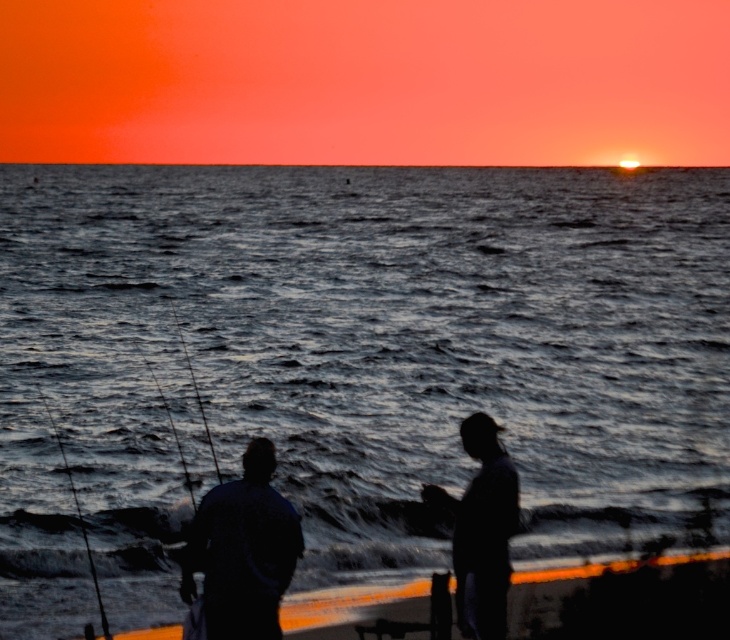
How distant is dark gray water at center from metallic fishing pole at left?

dark gray water at center and metallic fishing pole at left are 220.48 feet apart from each other.

Does dark gray water at center have a lesser height compared to metallic fishing pole at left?

No, dark gray water at center is not shorter than metallic fishing pole at left.

Is point (153, 474) closer to camera compared to point (182, 452)?

Yes, it is.

At what (x,y) coordinates should I click in order to perform the action: click on dark gray water at center. Please return your answer as a coordinate pair (x, y). Image resolution: width=730 pixels, height=640 pixels. Looking at the image, I should click on (353, 364).

Between silhouette fishing rod at lower right and smooth black fishing pole at center-left, which one is positioned higher?

Positioned higher is smooth black fishing pole at center-left.

Is silhouette fishing rod at lower right thinner than smooth black fishing pole at center-left?

Yes.

Which is behind, point (491, 634) or point (180, 337)?

Positioned behind is point (180, 337).

Where is `silhouette fishing rod at lower right`? Image resolution: width=730 pixels, height=640 pixels. silhouette fishing rod at lower right is located at coordinates (480, 529).

Does silhouette fishing rod at center come in front of smooth black rod at left?

Yes, it is in front of smooth black rod at left.

Who is positioned more to the right, silhouette fishing rod at center or smooth black rod at left?

silhouette fishing rod at center

Measure the distance between point (188, 600) and camera.

Point (188, 600) and camera are 8.33 meters apart.

This screenshot has height=640, width=730. In order to click on silhouette fishing rod at center in this screenshot , I will do `click(242, 550)`.